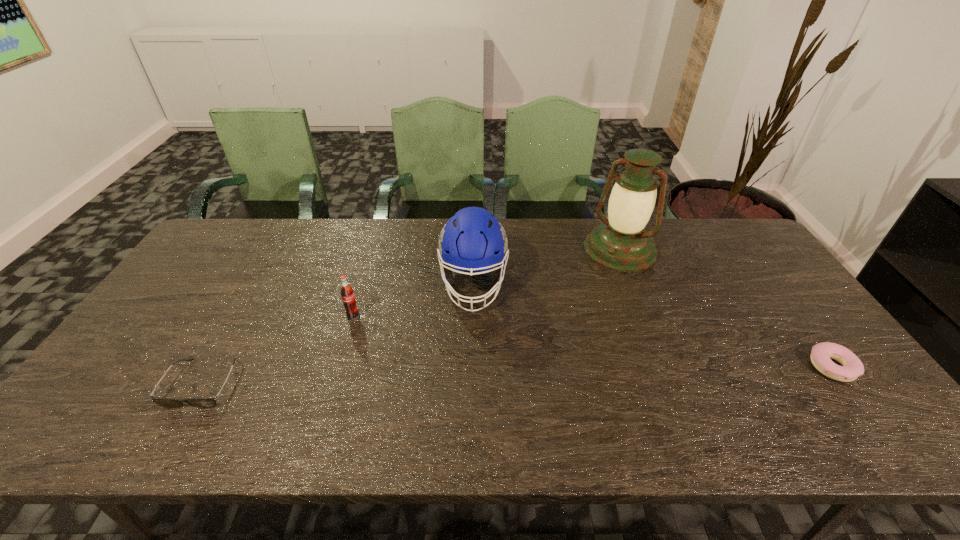
At what (x,y) coordinates should I click in order to perform the action: click on the leftmost object. Please return your answer as a coordinate pair (x, y). Looking at the image, I should click on (164, 402).

Identify the location of the rightmost object. tap(822, 353).

Identify the location of soda bottle. This screenshot has width=960, height=540. (348, 298).

I want to click on the third shortest object, so click(x=348, y=298).

Where is `the tallest object`? the tallest object is located at coordinates (621, 243).

Locate an element on the screen. Image resolution: width=960 pixels, height=540 pixels. the second object from right to left is located at coordinates (621, 243).

Find the location of a particular element. This screenshot has width=960, height=540. football helmet is located at coordinates (473, 240).

Identify the location of the third object from right to left. This screenshot has width=960, height=540. (473, 240).

This screenshot has height=540, width=960. What are the coordinates of `free location located on the left of the rightmost object` in the screenshot? It's located at (686, 368).

What are the coordinates of `free space located 0.400m on the label of the soda bottle` in the screenshot? It's located at (479, 381).